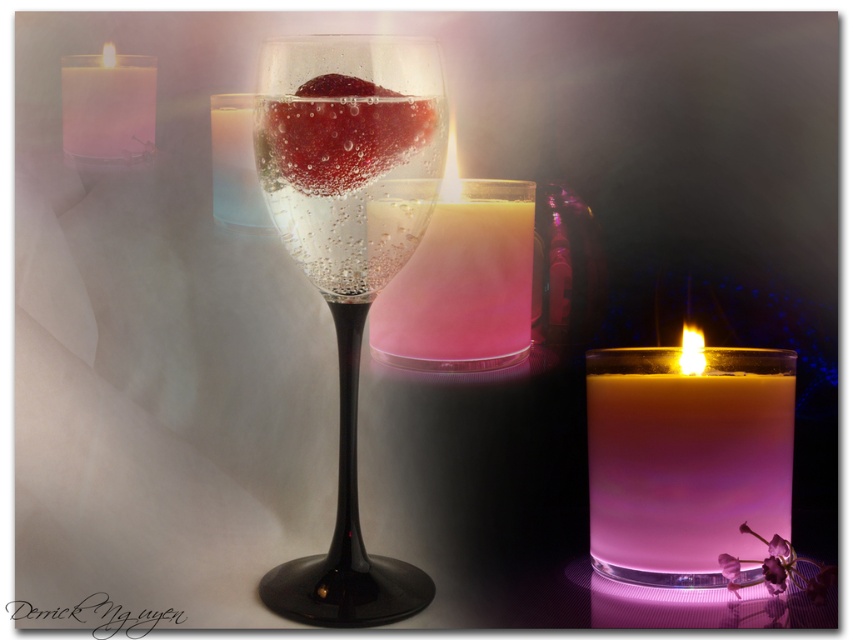
Question: Is clear glass wine glass at center to the left of translucent pink candle at center from the viewer's perspective?

Choices:
 (A) yes
 (B) no

Answer: (A)

Question: Among these objects, which one is farthest from the camera?

Choices:
 (A) clear glass wine glass at center
 (B) white wax candle at center

Answer: (B)

Question: Is white wax candle at center to the left of translucent pink candle at center from the viewer's perspective?

Choices:
 (A) no
 (B) yes

Answer: (A)

Question: Which of the following is the farthest from the observer?

Choices:
 (A) clear glass wine glass at center
 (B) translucent pink candle at center
 (C) translucent glass candle at upper left
 (D) white wax candle at upper left

Answer: (D)

Question: Is white wax candle at center bigger than white wax candle at upper left?

Choices:
 (A) yes
 (B) no

Answer: (A)

Question: Estimate the real-world distances between objects in this image. Which object is farther from the translucent pink candle at center?

Choices:
 (A) translucent glass candle at upper left
 (B) white wax candle at upper left
 (C) white wax candle at center

Answer: (B)